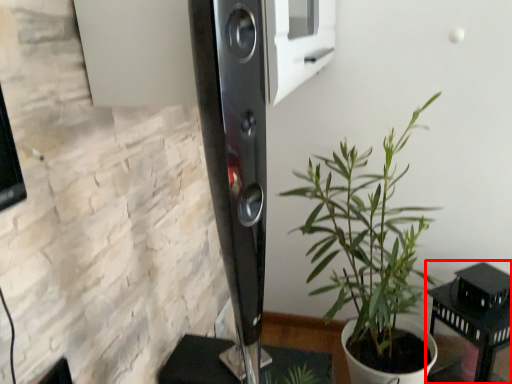
Question: Observing the image, what is the correct spatial positioning of furniture (annotated by the red box) in reference to houseplant?

Choices:
 (A) left
 (B) right

Answer: (B)